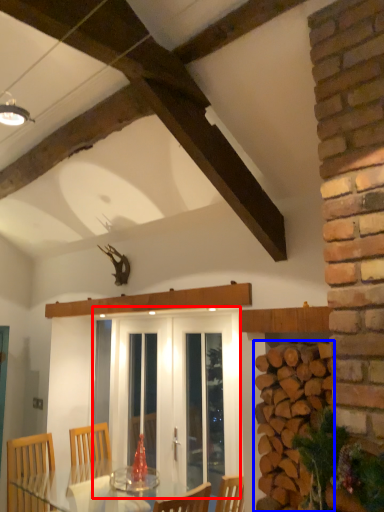
Question: Among these objects, which one is nearest to the camera, screen door (highlighted by a red box) or brickwork (highlighted by a blue box)?

Choices:
 (A) screen door
 (B) brickwork

Answer: (B)